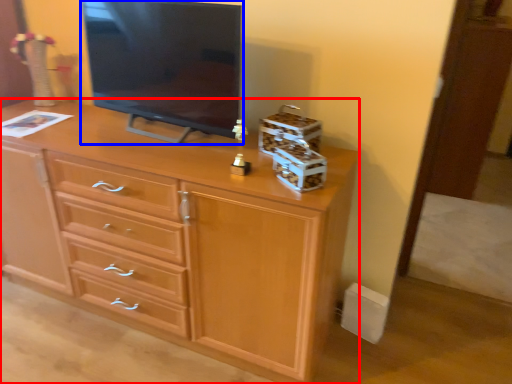
Question: Which of the following is the closest to the observer, chest of drawers (highlighted by a red box) or television (highlighted by a blue box)?

Choices:
 (A) chest of drawers
 (B) television

Answer: (A)